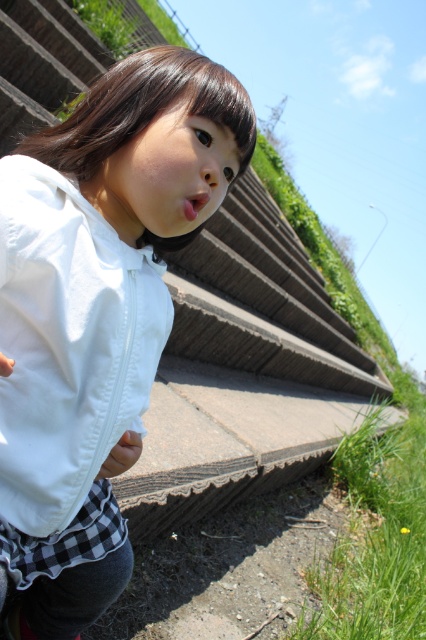
Which is more to the left, white matte jacket at center or white matte jacket at lower left?

white matte jacket at center

Does white matte jacket at center lie in front of white matte jacket at lower left?

Yes, white matte jacket at center is in front of white matte jacket at lower left.

Does point (40, 180) come behind point (40, 314)?

Yes, point (40, 180) is farther from viewer.

This screenshot has height=640, width=426. Identify the location of white matte jacket at center. (x=97, y=312).